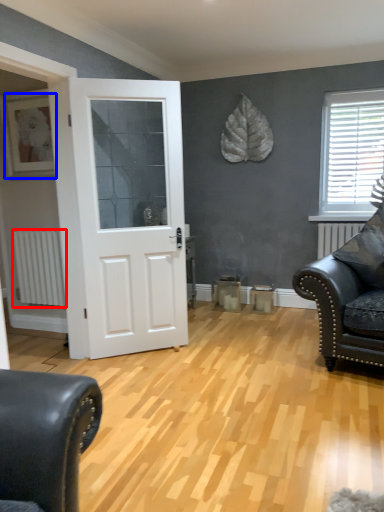
Question: Which of the following is the closest to the observer, radiator (highlighted by a red box) or picture frame (highlighted by a blue box)?

Choices:
 (A) radiator
 (B) picture frame

Answer: (B)